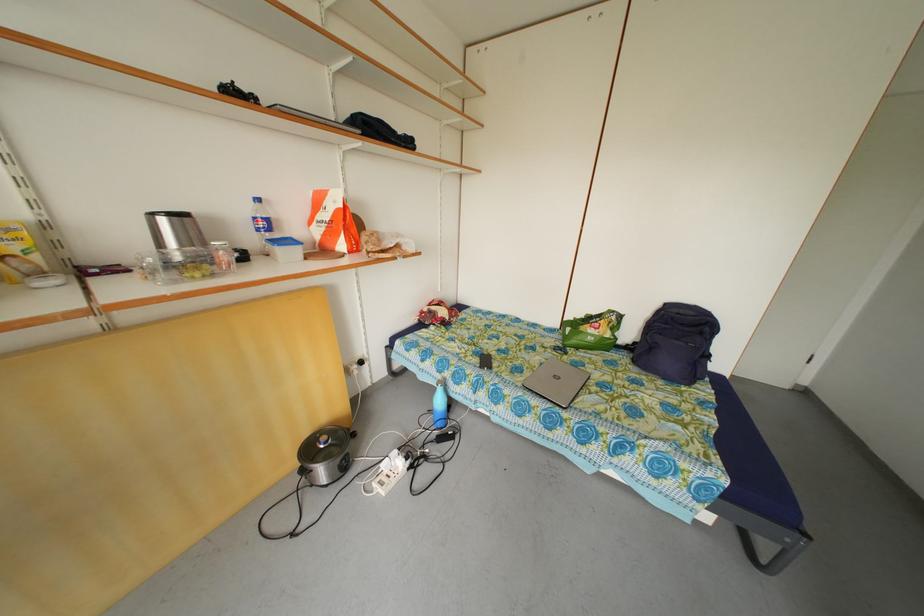
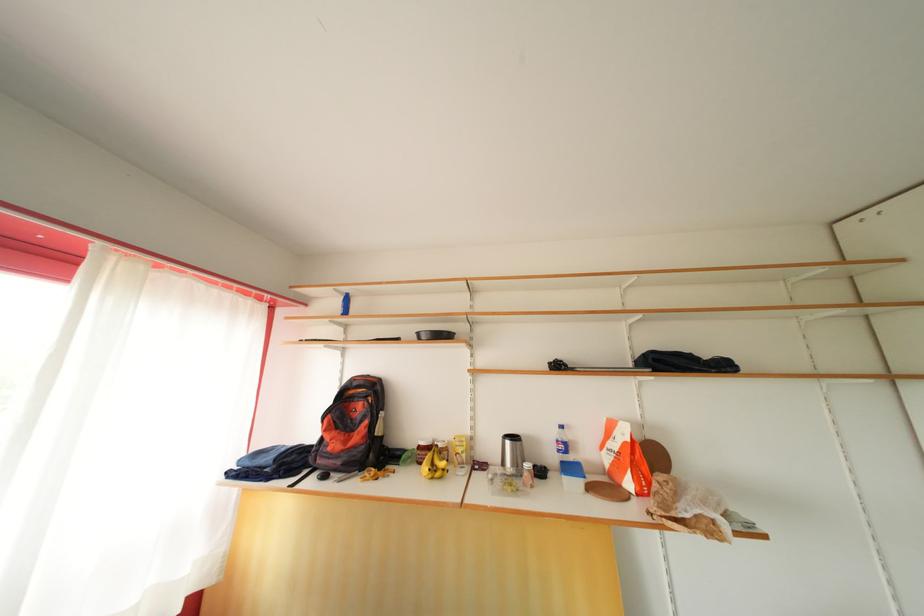
Where in the second image is the point corresponding to point (270, 230) from the first image?

(568, 453)